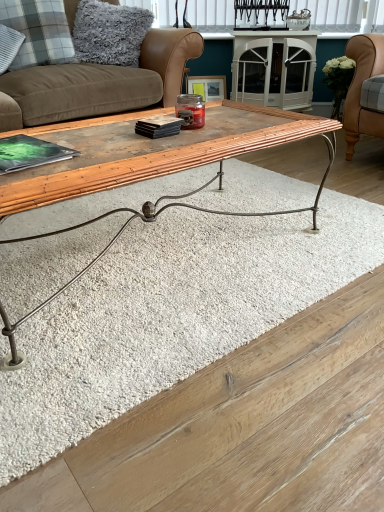
Where is `vacant space situated above wooden bamboo coffee table at center (from a real-world perspective)`? Image resolution: width=384 pixels, height=512 pixels. vacant space situated above wooden bamboo coffee table at center (from a real-world perspective) is located at coordinates (157, 137).